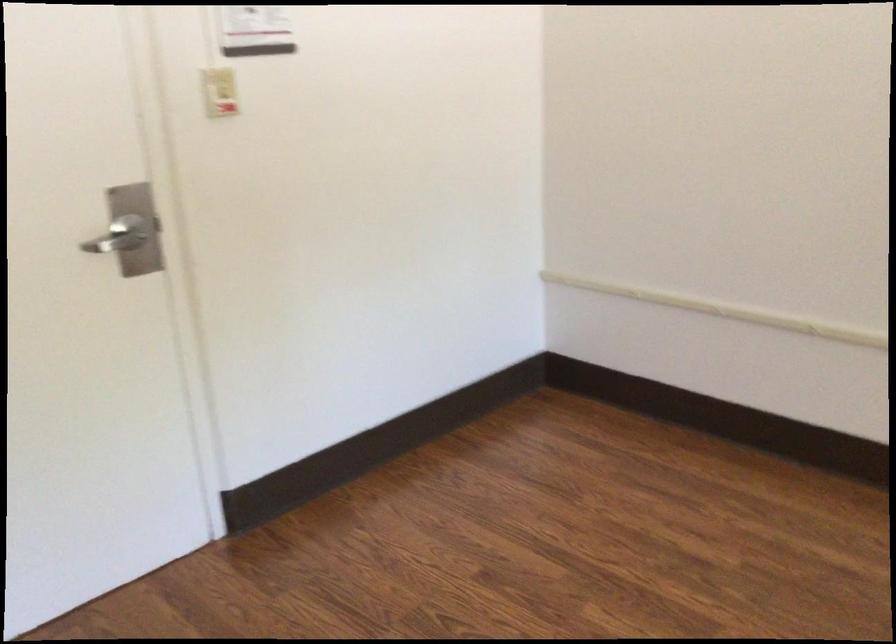
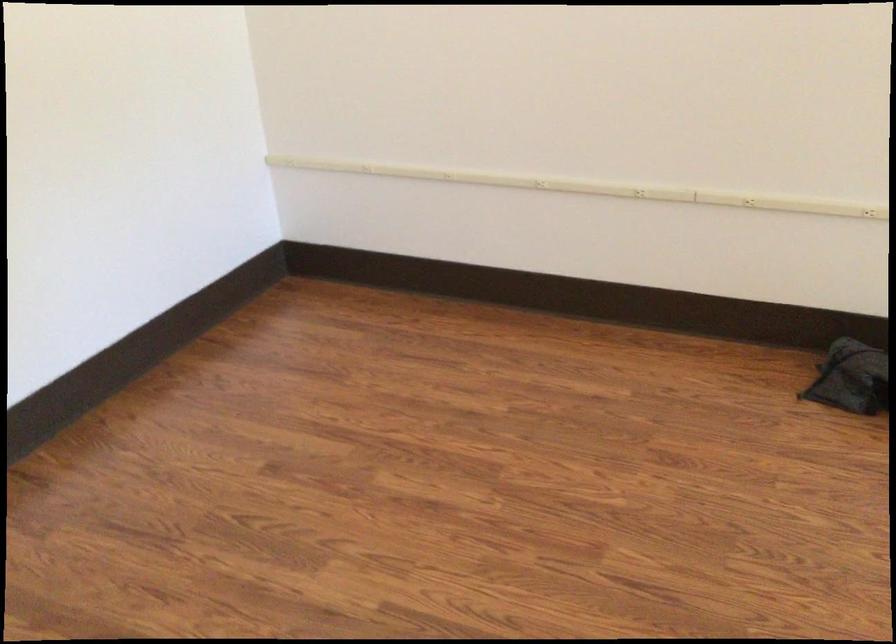
Find the pixel in the second image that matches point 814,315 in the first image.

(538, 171)